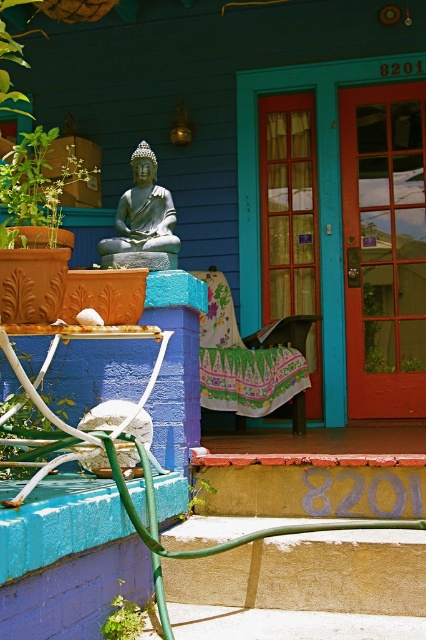
Does floral fabric rocking chair at center appear over green leafy plant at left?

Actually, floral fabric rocking chair at center is below green leafy plant at left.

Between floral fabric rocking chair at center and green leafy plant at left, which one has less height?

Standing shorter between the two is green leafy plant at left.

Is point (279, 387) positioned after point (9, 196)?

Yes, it is.

Where is `floral fabric rocking chair at center`? Image resolution: width=426 pixels, height=640 pixels. floral fabric rocking chair at center is located at coordinates (256, 349).

Is point (25, 161) positioned after point (120, 632)?

Yes, it is behind point (120, 632).

Is point (39, 218) behind point (126, 636)?

Yes, point (39, 218) is behind point (126, 636).

I want to click on green leafy plant at left, so click(x=37, y=186).

Is green leafy plant at lower left positioned at the back of green leafy plant at lower center?

No, green leafy plant at lower left is in front of green leafy plant at lower center.

Which is behind, point (126, 624) or point (193, 499)?

The point (193, 499) is more distant.

At what (x,y) coordinates should I click in order to perform the action: click on green leafy plant at lower left. Please return your answer as a coordinate pair (x, y). This screenshot has width=426, height=640. Looking at the image, I should click on (126, 618).